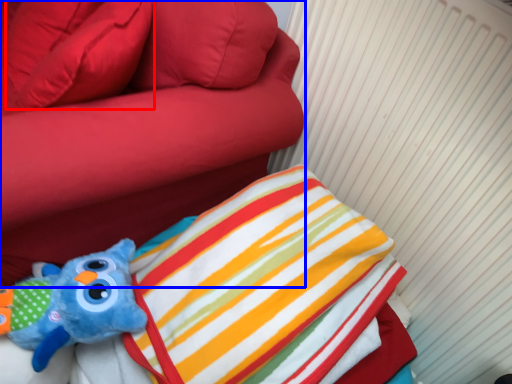
Question: Among these objects, which one is farthest to the camera, pillow (highlighted by a red box) or furniture (highlighted by a blue box)?

Choices:
 (A) pillow
 (B) furniture

Answer: (A)